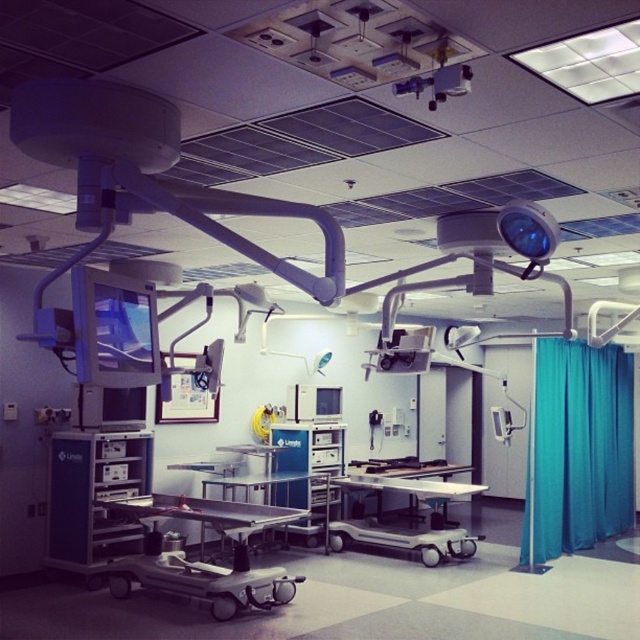
You are a surgical nurse preparing for an operation. You need to place a sterile tray on the surface closest to the ceiling. Which object should you use between the metallic stainless steel surgical table at center and the metallic silver cart at center?

The metallic stainless steel surgical table at center is located above the metallic silver cart at center, so you should place the sterile tray on the metallic stainless steel surgical table at center since it is closer to the ceiling.

In the operating room scene, you need to move the metallic silver cart at center closer to the teal fabric curtain at right. Which direction should you push the cart to get it in front of the curtain?

You should push the metallic silver cart at center forward towards the teal fabric curtain at right so that it moves from behind the curtain to in front of it, as it is currently positioned behind the teal fabric curtain at right.